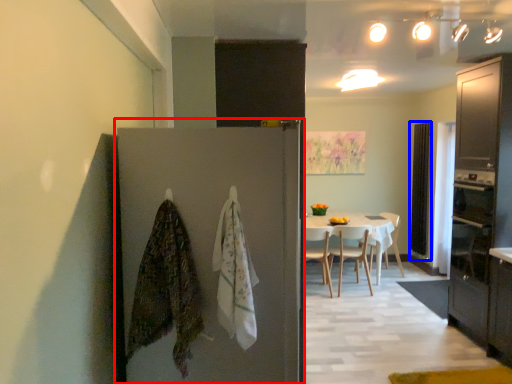
Question: Among these objects, which one is nearest to the camera, door (highlighted by a red box) or screen door (highlighted by a blue box)?

Choices:
 (A) door
 (B) screen door

Answer: (A)